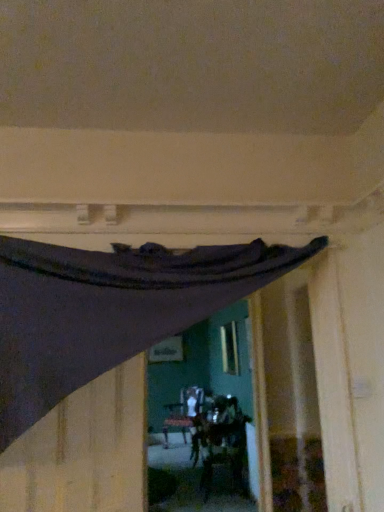
Question: Considering the relative positions of dark fabric curtain at upper center and dark matte fabric at upper left in the image provided, is dark fabric curtain at upper center to the right of dark matte fabric at upper left from the viewer's perspective?

Choices:
 (A) no
 (B) yes

Answer: (B)

Question: Does dark fabric curtain at upper center turn towards dark matte fabric at upper left?

Choices:
 (A) no
 (B) yes

Answer: (B)

Question: From the image's perspective, is dark fabric curtain at upper center located above dark matte fabric at upper left?

Choices:
 (A) yes
 (B) no

Answer: (A)

Question: From a real-world perspective, is dark fabric curtain at upper center below dark matte fabric at upper left?

Choices:
 (A) no
 (B) yes

Answer: (A)

Question: From a real-world perspective, is dark fabric curtain at upper center over dark matte fabric at upper left?

Choices:
 (A) no
 (B) yes

Answer: (B)

Question: Is dark fabric curtain at upper center wider than dark matte fabric at upper left?

Choices:
 (A) yes
 (B) no

Answer: (A)

Question: Is dark matte fabric at upper left bigger than dark fabric curtain at upper center?

Choices:
 (A) no
 (B) yes

Answer: (A)

Question: Is dark matte fabric at upper left positioned with its back to dark fabric curtain at upper center?

Choices:
 (A) no
 (B) yes

Answer: (B)

Question: From a real-world perspective, is dark matte fabric at upper left on dark fabric curtain at upper center?

Choices:
 (A) no
 (B) yes

Answer: (A)

Question: Is dark matte fabric at upper left positioned in front of dark fabric curtain at upper center?

Choices:
 (A) yes
 (B) no

Answer: (B)

Question: Is dark matte fabric at upper left touching dark fabric curtain at upper center?

Choices:
 (A) yes
 (B) no

Answer: (B)

Question: Is dark matte fabric at upper left oriented towards dark fabric curtain at upper center?

Choices:
 (A) no
 (B) yes

Answer: (B)

Question: Considering their positions, is dark matte fabric at upper left located in front of or behind dark fabric curtain at upper center?

Choices:
 (A) front
 (B) behind

Answer: (B)